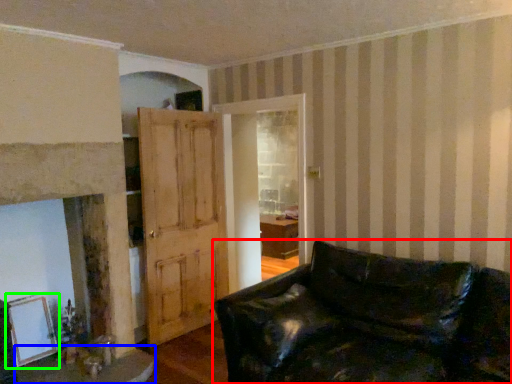
Question: Which is farther away from studio couch (highlighted by a red box)? table (highlighted by a blue box) or picture frame (highlighted by a green box)?

Choices:
 (A) table
 (B) picture frame

Answer: (B)